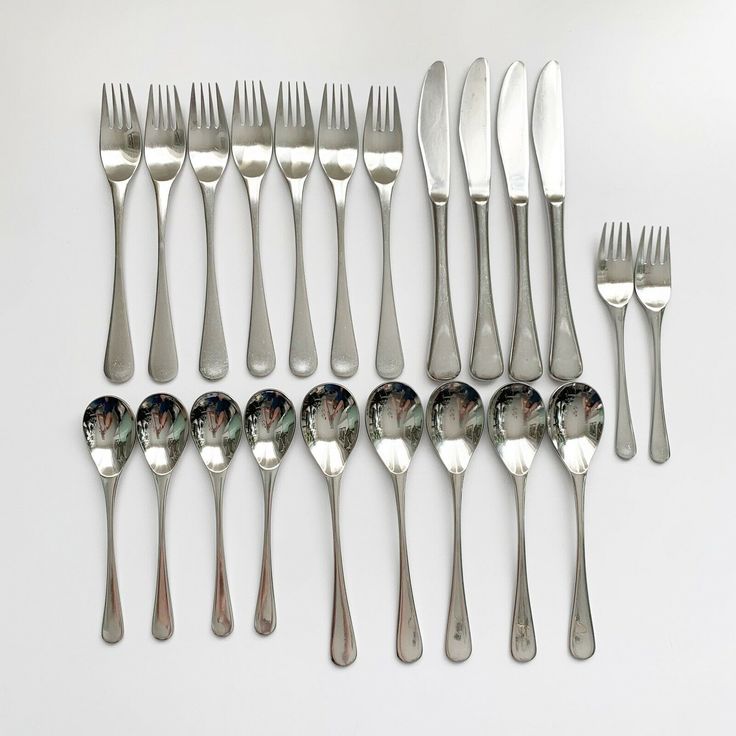
Image resolution: width=736 pixels, height=736 pixels. In order to click on knives in this screenshot , I will do `click(433, 152)`, `click(477, 132)`, `click(506, 135)`, `click(556, 155)`.